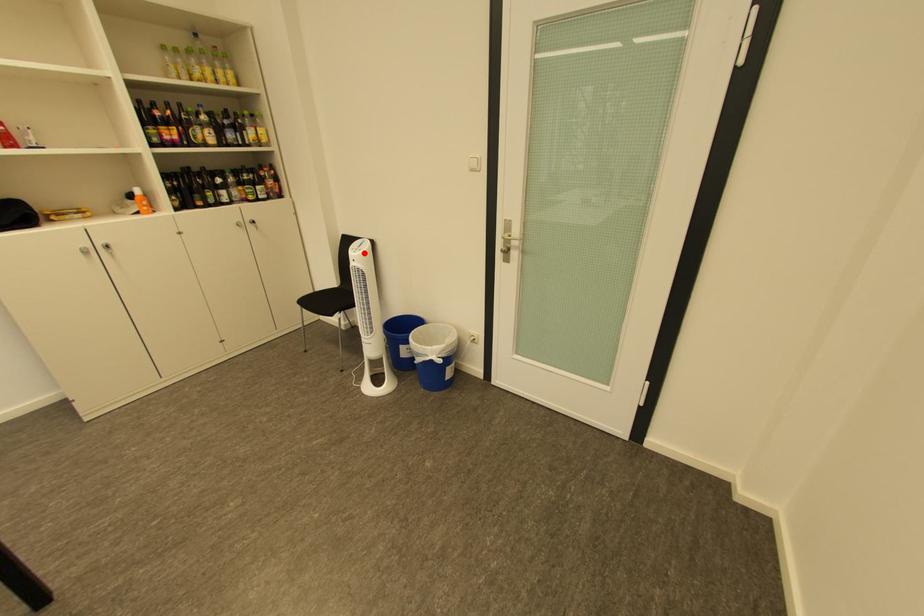
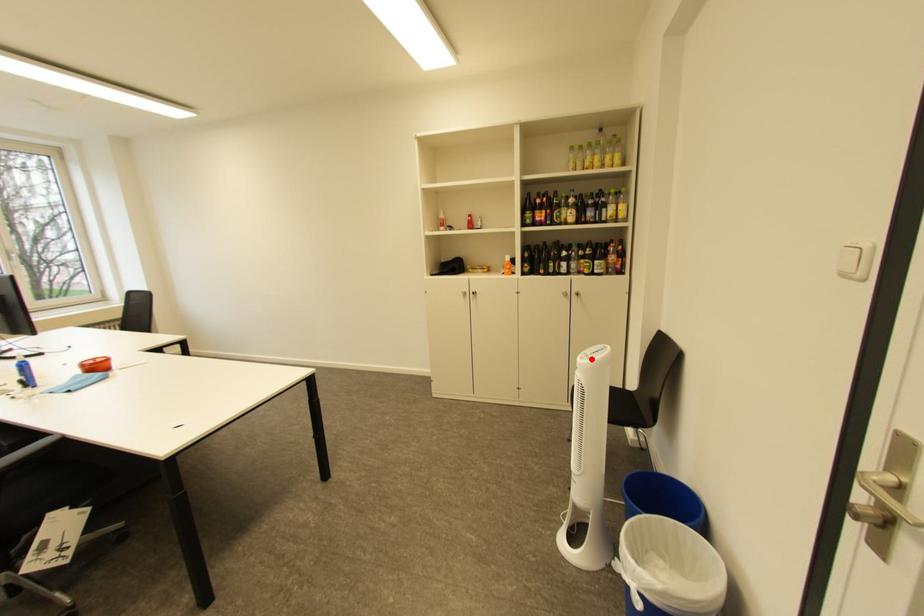
I am providing you with two images of the same scene from different viewpoints. A red point is marked on the first image and another point is marked on the second image. Are the points marked in image1 and image2 representing the same 3D position?

Yes